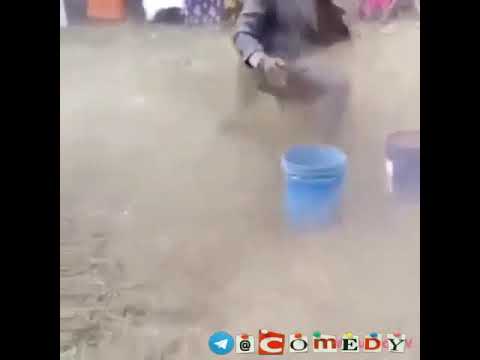
The height and width of the screenshot is (360, 480). What are the coordinates of `blue bucket` in the screenshot? It's located at [318, 186].